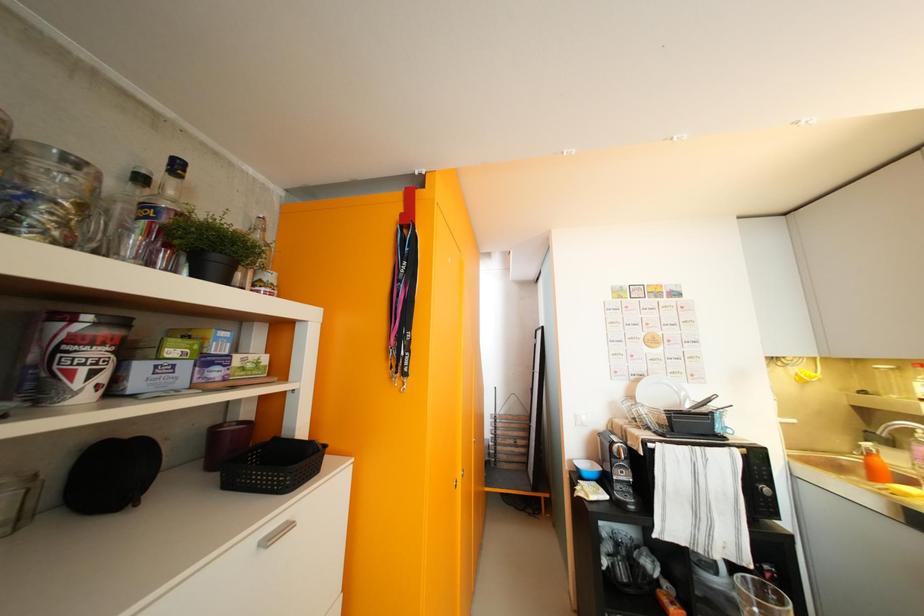
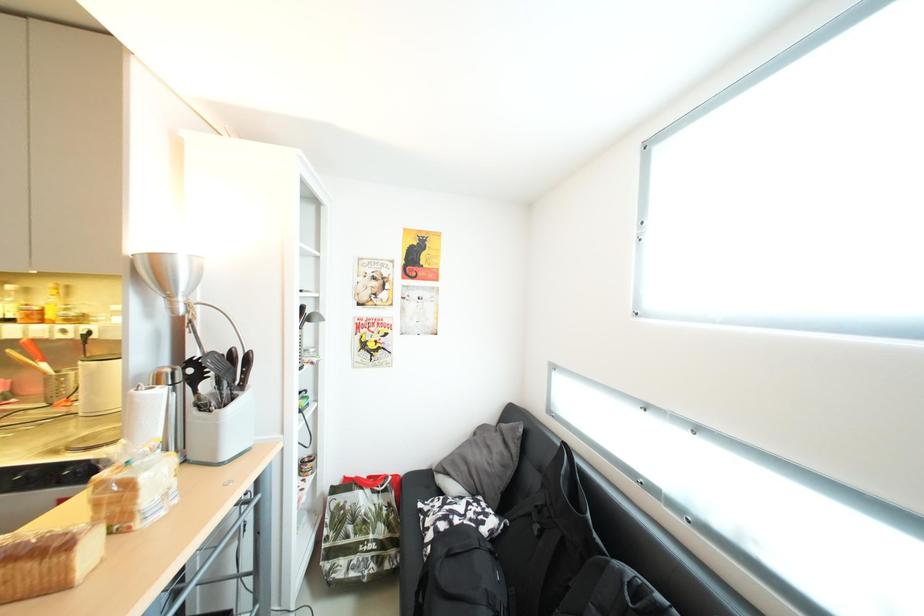
Question: The camera is either moving clockwise (left) or counter-clockwise (right) around the object. The first image is from the beginning of the video and the second image is from the end. Is the camera moving left or right when shooting the video?

Choices:
 (A) Left
 (B) Right

Answer: (A)